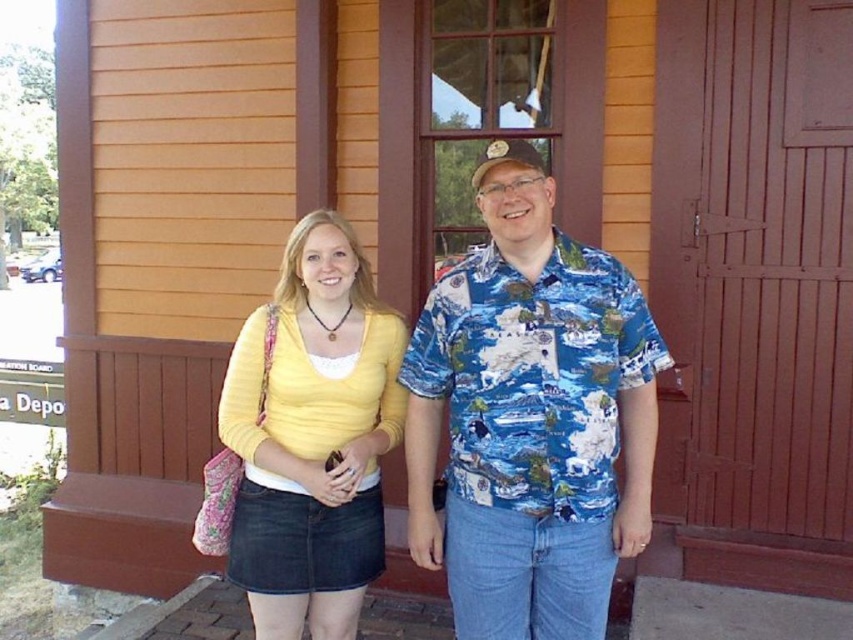
Question: Can you confirm if blue printed shirt at center is positioned to the left of matte yellow sweater at center?

Choices:
 (A) yes
 (B) no

Answer: (B)

Question: Among these points, which one is nearest to the camera?

Choices:
 (A) (651, 442)
 (B) (373, 440)

Answer: (A)

Question: Does blue printed shirt at center appear on the right side of matte yellow sweater at center?

Choices:
 (A) yes
 (B) no

Answer: (A)

Question: Is blue printed shirt at center positioned in front of matte yellow sweater at center?

Choices:
 (A) no
 (B) yes

Answer: (B)